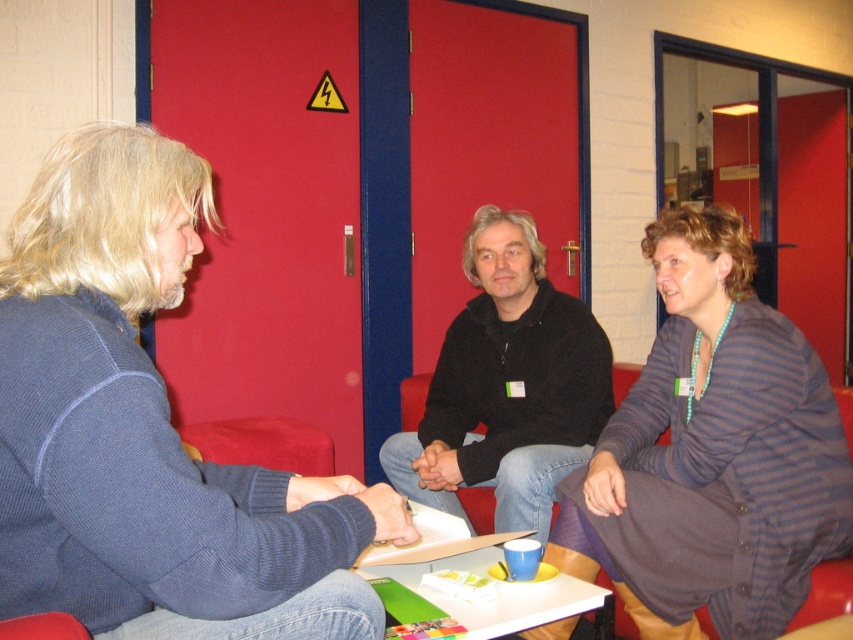
You are arranging furniture for a photoshoot and need to place the striped knit cardigan at center and the brown fabric armchair at lower right. Based on the scene description, which object should be positioned to the right side of the other?

The striped knit cardigan at center is to the left of brown fabric armchair at lower right, so the brown fabric armchair at lower right should be positioned to the right side of the striped knit cardigan at center.

You are a photographer setting up a shoot in this room. You need to place a small prop on the white glossy table at center without it being obscured by the blue fabric sweater at left. Is this possible?

The blue fabric sweater at left is located above the white glossy table at center, so placing the prop on the table might still be possible if positioned away from where the sweater hangs or rests over the table.

You are standing in the room and need to find the blue fabric sweater at left. According to the coordinates provided, where exactly is it positioned?

The blue fabric sweater at left is located at point 0.656 on the x axis and 0.163 on the y axis.